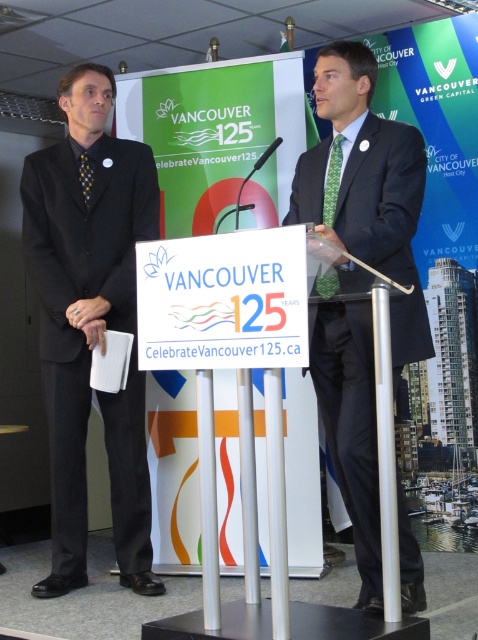
Question: Among these points, which one is nearest to the camera?

Choices:
 (A) 390,252
 (B) 147,476

Answer: (A)

Question: Can you confirm if black suit at left is bigger than matte black suit at center?

Choices:
 (A) no
 (B) yes

Answer: (A)

Question: Which point is closer to the camera?

Choices:
 (A) black suit at left
 (B) matte black suit at center

Answer: (B)

Question: Is black suit at left further to the viewer compared to matte black suit at center?

Choices:
 (A) yes
 (B) no

Answer: (A)

Question: Among these objects, which one is farthest from the camera?

Choices:
 (A) matte black suit at center
 (B) black suit at left

Answer: (B)

Question: Does black suit at left lie in front of matte black suit at center?

Choices:
 (A) no
 (B) yes

Answer: (A)